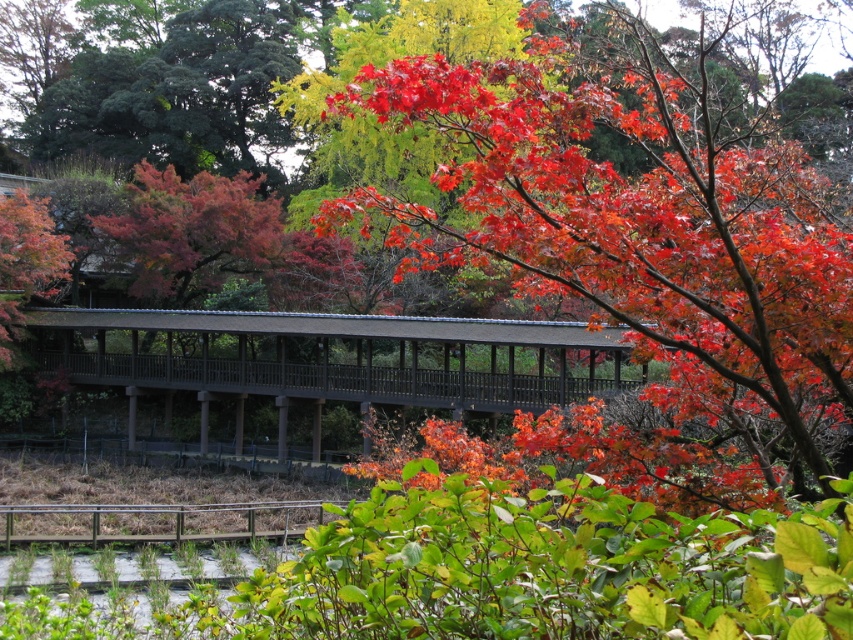
Is shiny red maple at center to the right of brown wooden bridge at center from the viewer's perspective?

Correct, you'll find shiny red maple at center to the right of brown wooden bridge at center.

You are a GUI agent. You are given a task and a screenshot of the screen. Output one action in this format:
    pyautogui.click(x=<x>, y=<y>)
    Task: Click on the shiny red maple at center
    
    Given the screenshot: What is the action you would take?
    pyautogui.click(x=637, y=234)